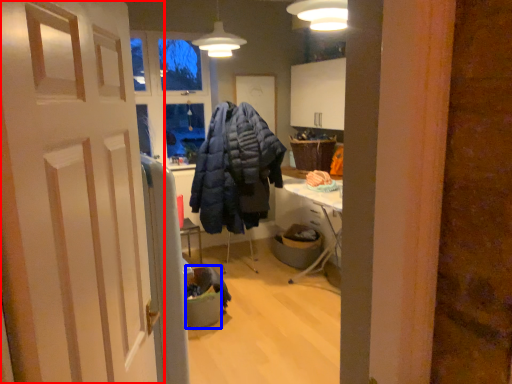
Question: Which object is closer to the camera taking this photo, door (highlighted by a red box) or trash bin/can (highlighted by a blue box)?

Choices:
 (A) door
 (B) trash bin/can

Answer: (A)